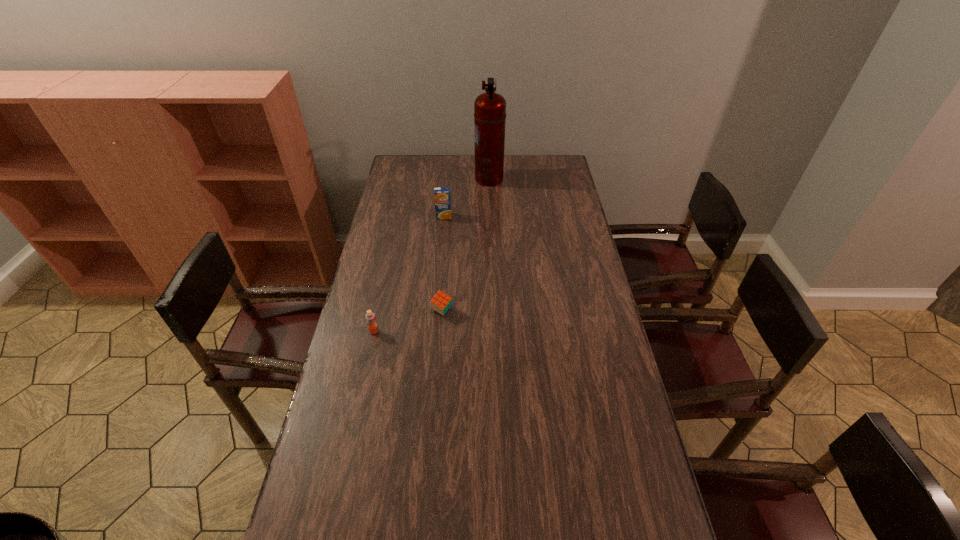
The height and width of the screenshot is (540, 960). What are the coordinates of `vacant area located 0.360m on the nozzle side of the farthest object` in the screenshot? It's located at (401, 179).

Find the location of a particular element. The width and height of the screenshot is (960, 540). vacant area located on the front of the second farthest object is located at coordinates (440, 254).

Locate an element on the screen. free space located 0.060m on the front of the shorter orange juice is located at coordinates (370, 349).

The width and height of the screenshot is (960, 540). Find the location of `vacant space situated on the right of the shortest object`. vacant space situated on the right of the shortest object is located at coordinates (493, 310).

Locate an element on the screen. object that is at the far edge is located at coordinates (489, 108).

Where is `object at the left edge`? The image size is (960, 540). object at the left edge is located at coordinates (370, 317).

Where is `free space at the far edge`? Image resolution: width=960 pixels, height=540 pixels. free space at the far edge is located at coordinates (513, 164).

This screenshot has height=540, width=960. In the image, there is a desktop. Find the location of `free space at the left edge`. free space at the left edge is located at coordinates (337, 478).

Locate an element on the screen. vacant position at the right edge of the desktop is located at coordinates (564, 193).

In the image, there is a desktop. Find the location of `vacant area at the far left corner`. vacant area at the far left corner is located at coordinates (408, 178).